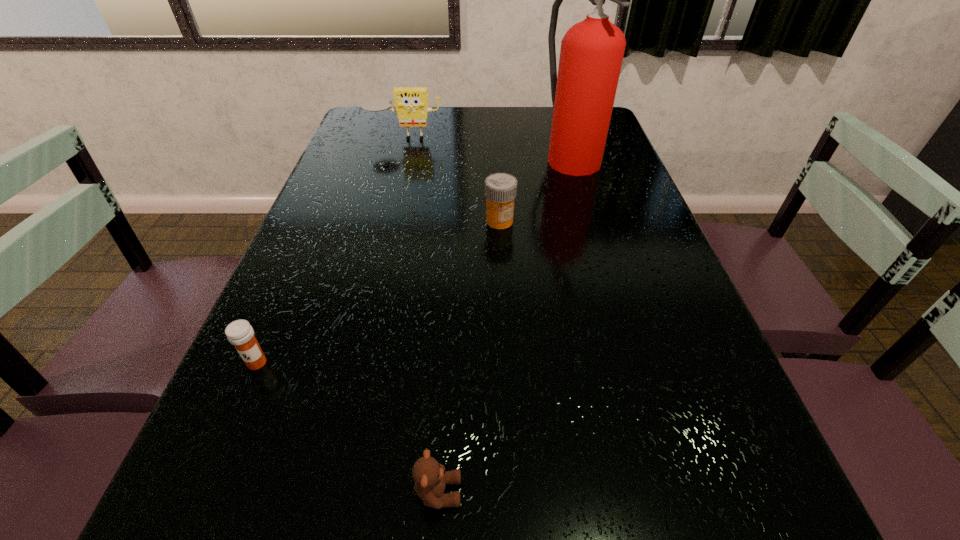
Locate an element on the screen. Image resolution: width=960 pixels, height=540 pixels. the rightmost object is located at coordinates (583, 93).

Where is `the tallest object`? The height and width of the screenshot is (540, 960). the tallest object is located at coordinates (583, 93).

The width and height of the screenshot is (960, 540). I want to click on the second object from left to right, so click(411, 104).

The height and width of the screenshot is (540, 960). In order to click on the fourth shortest object in this screenshot , I will do `click(411, 104)`.

At what (x,y) coordinates should I click in order to perform the action: click on the third farthest object. Please return your answer as a coordinate pair (x, y). This screenshot has height=540, width=960. Looking at the image, I should click on (500, 188).

Find the location of a particular element. The width and height of the screenshot is (960, 540). the right medicine is located at coordinates (500, 188).

Where is `the shorter medicine`? The image size is (960, 540). the shorter medicine is located at coordinates click(x=240, y=333).

You are a GUI agent. You are given a task and a screenshot of the screen. Output one action in this format:
    pyautogui.click(x=<x>, y=<y>)
    Task: Click on the left medicine
    The image size is (960, 540).
    Given the screenshot: What is the action you would take?
    pyautogui.click(x=240, y=333)

You are a GUI agent. You are given a task and a screenshot of the screen. Output one action in this format:
    pyautogui.click(x=<x>, y=<y>)
    Task: Click on the nearest object
    This screenshot has width=960, height=540.
    Given the screenshot: What is the action you would take?
    pyautogui.click(x=430, y=477)

The height and width of the screenshot is (540, 960). I want to click on teddy bear, so click(x=430, y=477).